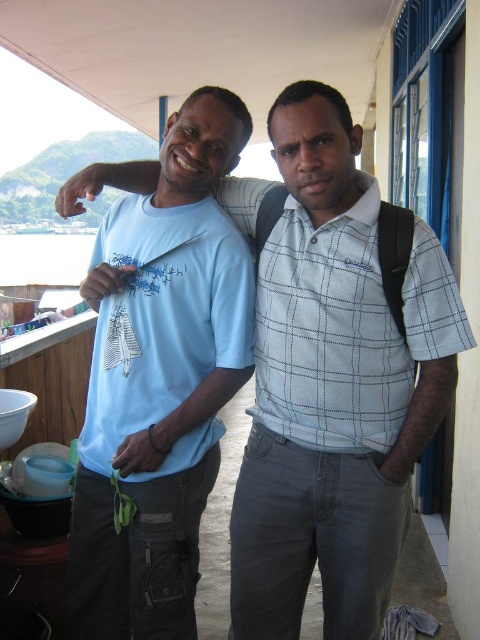
Question: Is light blue checkered shirt at center to the left of light blue cotton t-shirt at center from the viewer's perspective?

Choices:
 (A) yes
 (B) no

Answer: (B)

Question: Which point is closer to the camera taking this photo?

Choices:
 (A) (223, 269)
 (B) (373, 240)
 (C) (121, 422)

Answer: (B)

Question: In this image, where is light blue checkered shirt at center located relative to light blue cotton t-shirt at center?

Choices:
 (A) below
 (B) above

Answer: (B)

Question: Which of the following is the farthest from the observer?

Choices:
 (A) light blue cotton t-shirt at left
 (B) light blue cotton t-shirt at center
 (C) light blue checkered shirt at center

Answer: (B)

Question: Does light blue cotton t-shirt at left lie behind light blue cotton t-shirt at center?

Choices:
 (A) yes
 (B) no

Answer: (B)

Question: Which point is closer to the camera?

Choices:
 (A) light blue cotton t-shirt at left
 (B) light blue checkered shirt at center
 (C) light blue cotton t-shirt at center

Answer: (B)